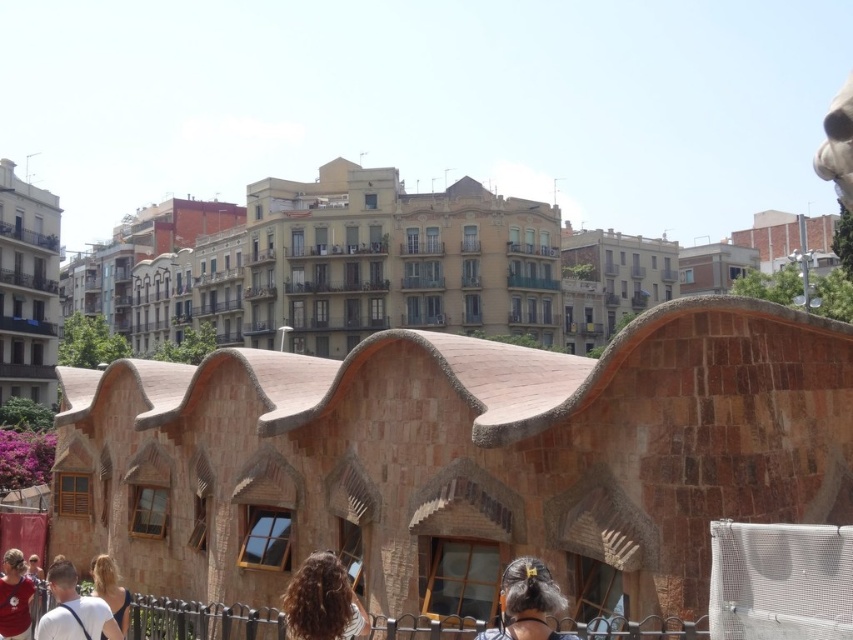
You are a photographer standing in the middle of the urban scene. You notice a person with curly hair at center and someone wearing a matte red shirt at lower left. Which of these two items is positioned higher up in the image?

The curly hair at center is taller than the matte red shirt at lower left, so the curly hair at center is positioned higher up in the image.

What is located at the coordinates point (322, 600) in the image?

The curly hair at center is located at point (322, 600).

From the picture: You are a photographer trying to capture a portrait of a person with dark brown hair at center and a matte red shirt at lower left. Which of these two items has a larger width in the image?

The dark brown hair at center has a larger width than the matte red shirt at lower left according to the description.